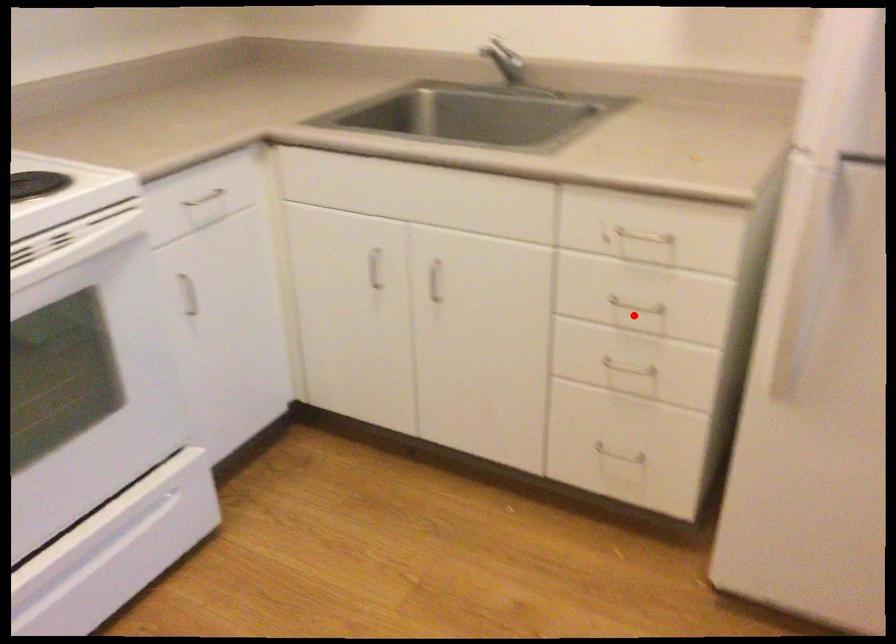
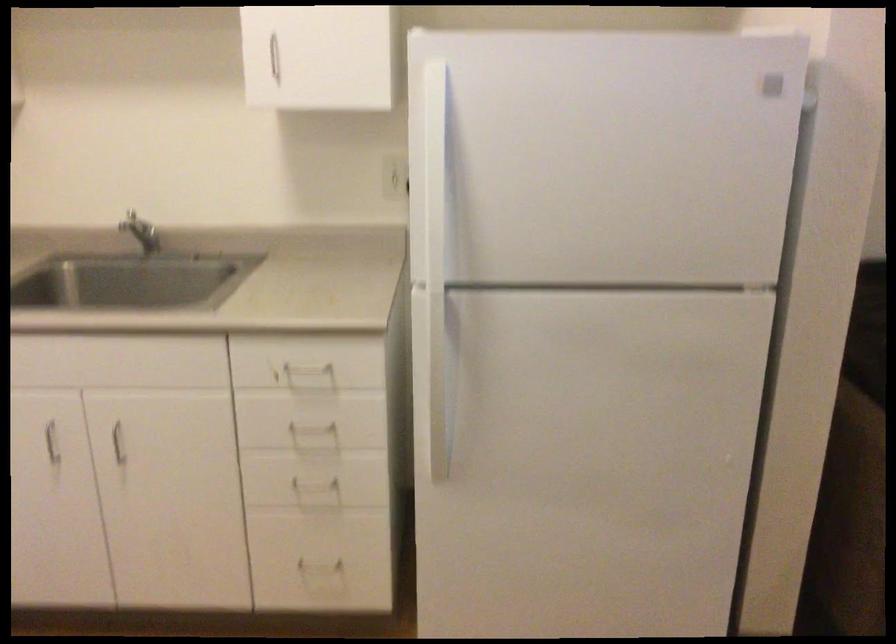
Where in the second image is the point corresponding to the highlighted location from the first image?

(314, 436)